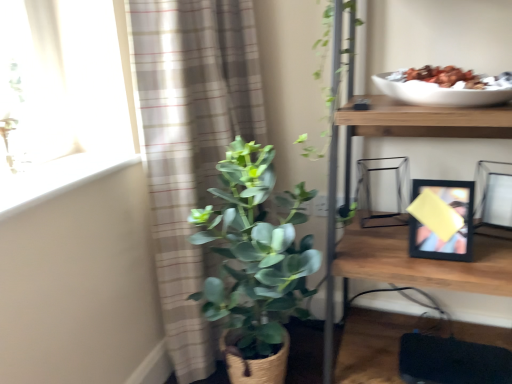
Question: Can you confirm if black matte picture frame at right, which is the 1th picture frame from left to right, is bigger than plaid fabric curtain at left?

Choices:
 (A) no
 (B) yes

Answer: (A)

Question: Is black matte picture frame at right, which is the 1th picture frame from left to right, directly adjacent to plaid fabric curtain at left?

Choices:
 (A) yes
 (B) no

Answer: (B)

Question: Is black matte picture frame at right, which is the 1th picture frame from left to right, positioned in front of plaid fabric curtain at left?

Choices:
 (A) yes
 (B) no

Answer: (B)

Question: From the image's perspective, is black matte picture frame at right, which is the 1th picture frame from left to right, above plaid fabric curtain at left?

Choices:
 (A) no
 (B) yes

Answer: (A)

Question: Considering the relative sizes of black matte picture frame at right, which is the second picture frame from right to left, and plaid fabric curtain at left in the image provided, is black matte picture frame at right, which is the second picture frame from right to left, taller than plaid fabric curtain at left?

Choices:
 (A) no
 (B) yes

Answer: (A)

Question: From a real-world perspective, is black matte picture frame at right, which is the second picture frame from right to left, beneath plaid fabric curtain at left?

Choices:
 (A) yes
 (B) no

Answer: (A)

Question: Is black matte picture frame at right, which is the 1th picture frame from left to right, smaller than green matte plant at center?

Choices:
 (A) yes
 (B) no

Answer: (A)

Question: Is black matte picture frame at right, which is the second picture frame from right to left, at the left side of green matte plant at center?

Choices:
 (A) yes
 (B) no

Answer: (B)

Question: Is black matte picture frame at right, which is the 1th picture frame from left to right, oriented towards green matte plant at center?

Choices:
 (A) yes
 (B) no

Answer: (B)

Question: Does black matte picture frame at right, which is the 1th picture frame from left to right, lie behind green matte plant at center?

Choices:
 (A) no
 (B) yes

Answer: (B)

Question: Is black matte picture frame at right, which is the 1th picture frame from left to right, not inside green matte plant at center?

Choices:
 (A) no
 (B) yes

Answer: (B)

Question: Is black matte picture frame at right, which is the second picture frame from right to left, far away from green matte plant at center?

Choices:
 (A) no
 (B) yes

Answer: (A)

Question: Is white smooth window sill at upper left at the back of plaid fabric curtain at left?

Choices:
 (A) no
 (B) yes

Answer: (A)